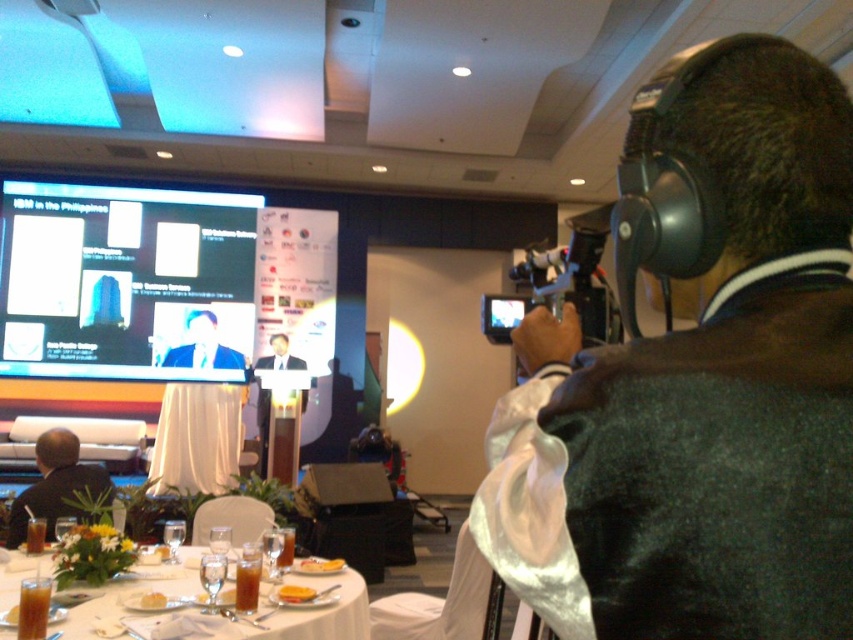
Question: Which object is closer to the camera taking this photo?

Choices:
 (A) dark suit jacket at lower left
 (B) yellow bread at center

Answer: (B)

Question: Where is yellow bread at center located in relation to golden crispy pastry at lower center in the image?

Choices:
 (A) right
 (B) left

Answer: (A)

Question: Observing the image, what is the correct spatial positioning of matte black screen at upper left in reference to dark suit jacket at lower left?

Choices:
 (A) above
 (B) below

Answer: (A)

Question: Estimate the real-world distances between objects in this image. Which object is closer to the yellow cake at center?

Choices:
 (A) matte black suit at center
 (B) golden crispy pastry at lower center
 (C) yellow bread at center

Answer: (C)

Question: Which of the following is the farthest from the observer?

Choices:
 (A) black fabric jacket at upper right
 (B) white glossy table at lower center
 (C) yellow bread at center

Answer: (C)

Question: Is matte black suit at center bigger than yellow bread at center?

Choices:
 (A) yes
 (B) no

Answer: (A)